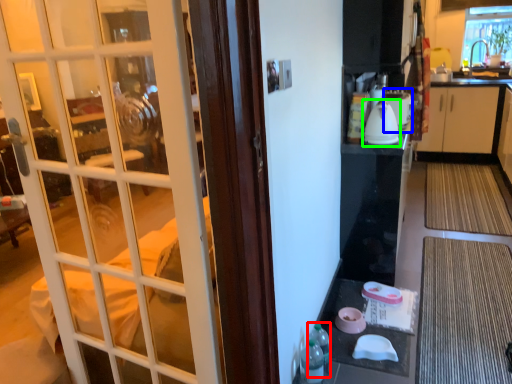
Question: Which is nearer to the bottle (highlighted by a red box)? appliance (highlighted by a blue box) or kitchen appliance (highlighted by a green box).

Choices:
 (A) appliance
 (B) kitchen appliance

Answer: (B)